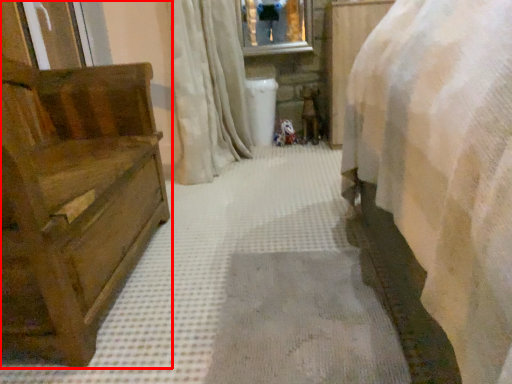
Question: Where is furniture (annotated by the red box) located in relation to curtain in the image?

Choices:
 (A) right
 (B) left

Answer: (B)